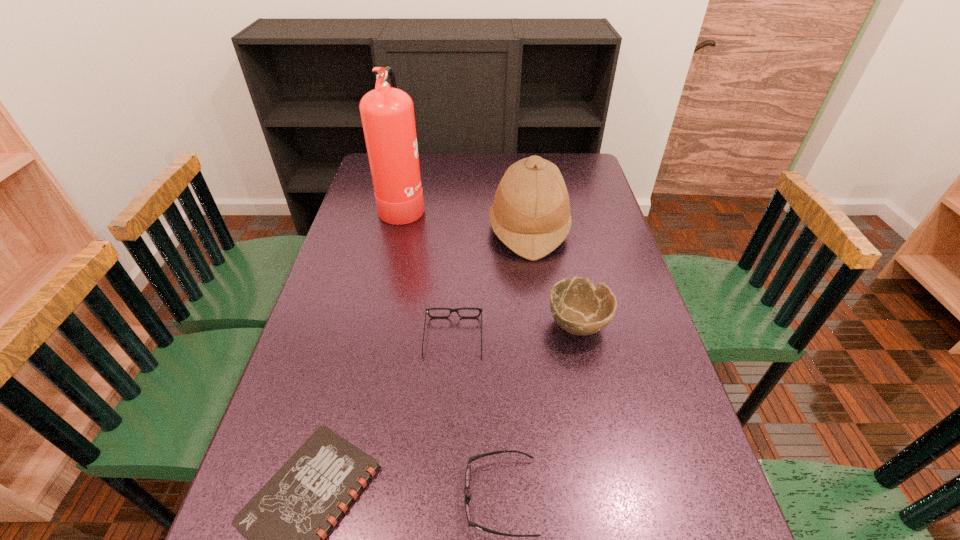
Identify the location of vacant space that satisfies the following two spatial constraints: 1. on the front-facing side of the second tallest object; 2. on the left side of the bowl. The height and width of the screenshot is (540, 960). (541, 323).